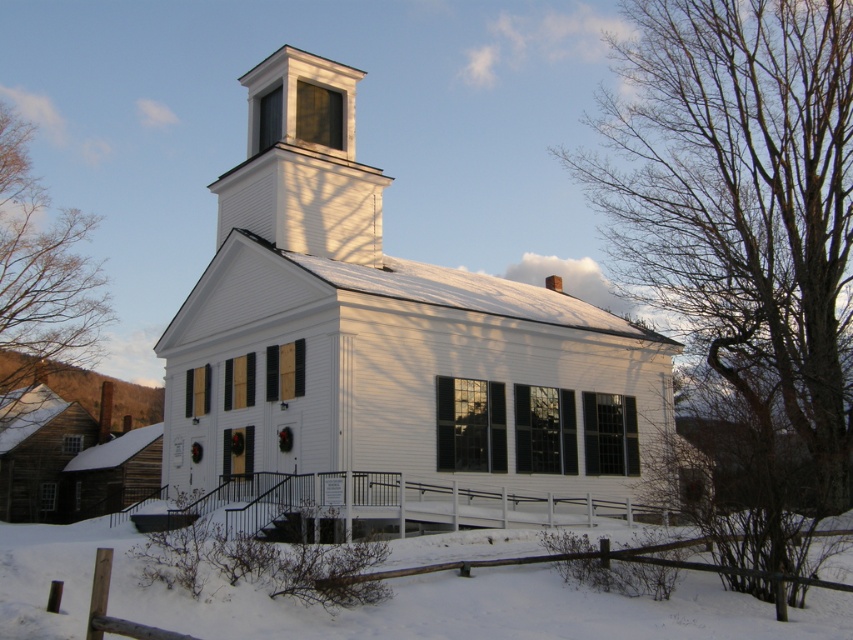
You are a drone operator tasked with capturing aerial footage of the white matte church at center and the brown leafless tree at left. The drone has a maximum flight range of 40 meters. Can you fly the drone from the church to the tree and back without exceeding the range limit?

The distance between the white matte church at center and the brown leafless tree at left is 38.89 meters. Since the round trip would be approximately 77.78 meters, which exceeds the drone maximum flight range of 40 meters, the drone cannot complete the round trip without exceeding the range limit.

You are standing at the point with coordinates point (x=387, y=352). Based on the scene description, what object are you most likely standing on?

The point (x=387, y=352) corresponds to the white matte church at center, so you are most likely standing on the white matte church at center.